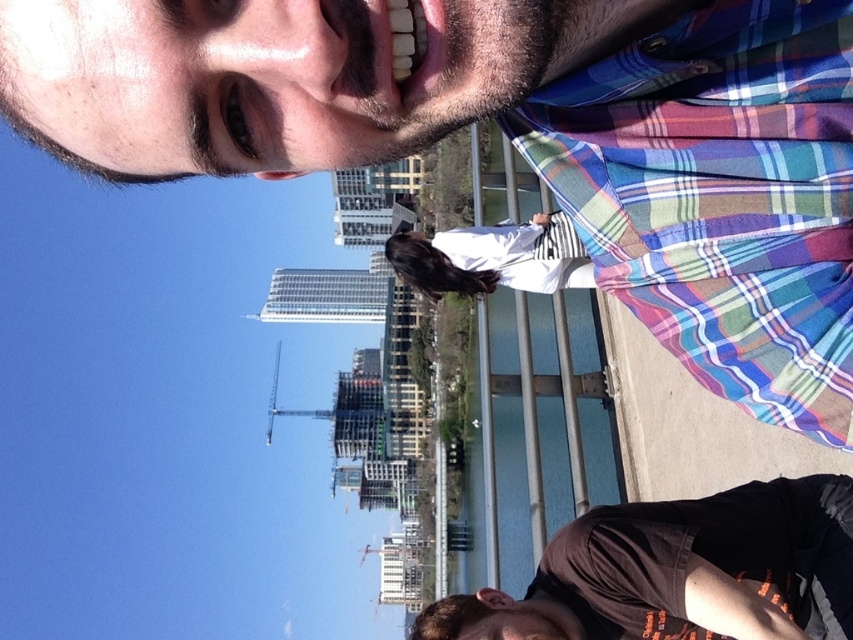
Is point (648, 608) in front of point (459, 272)?

Yes, it is in front of point (459, 272).

Does brown cotton shirt at lower right appear over white cotton shirt at center?

Actually, brown cotton shirt at lower right is below white cotton shirt at center.

Describe the element at coordinates (682, 572) in the screenshot. This screenshot has width=853, height=640. I see `brown cotton shirt at lower right` at that location.

Find the location of a particular element. brown cotton shirt at lower right is located at coordinates (682, 572).

How distant is multicolored plaid shirt at upper right from white cotton shirt at center?

The distance of multicolored plaid shirt at upper right from white cotton shirt at center is 317.28 feet.

Between point (553, 92) and point (508, 284), which one is positioned in front?

Positioned in front is point (553, 92).

Locate an element on the screen. multicolored plaid shirt at upper right is located at coordinates (720, 196).

Does multicolored plaid shirt at upper right have a lesser width compared to brown cotton shirt at lower right?

Yes, multicolored plaid shirt at upper right is thinner than brown cotton shirt at lower right.

Describe the element at coordinates (720, 196) in the screenshot. I see `multicolored plaid shirt at upper right` at that location.

Identify the location of multicolored plaid shirt at upper right. (720, 196).

Locate an element on the screen. This screenshot has width=853, height=640. multicolored plaid shirt at upper right is located at coordinates (720, 196).